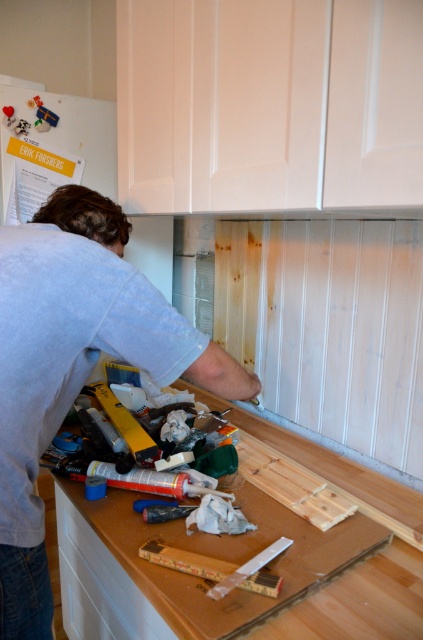
Which is behind, point (60, 323) or point (217, 566)?

Positioned behind is point (217, 566).

Is point (21, 362) closer to camera compared to point (214, 577)?

Yes, point (21, 362) is in front of point (214, 577).

The height and width of the screenshot is (640, 423). In order to click on gray cotton shirt at center in this screenshot , I will do `click(74, 364)`.

This screenshot has width=423, height=640. What do you see at coordinates (98, 586) in the screenshot?
I see `wooden drawer at lower left` at bounding box center [98, 586].

Does wooden drawer at lower left have a lesser height compared to wooden ruler at center?

Incorrect, wooden drawer at lower left's height does not fall short of wooden ruler at center's.

Describe the element at coordinates (98, 586) in the screenshot. The width and height of the screenshot is (423, 640). I see `wooden drawer at lower left` at that location.

Identify the location of wooden drawer at lower left. The image size is (423, 640). (98, 586).

In the scene shown: Which is more to the left, wooden at center or wooden ruler at center?

Positioned to the left is wooden ruler at center.

Is wooden at center bigger than wooden ruler at center?

Yes.

This screenshot has width=423, height=640. I want to click on wooden at center, so (360, 602).